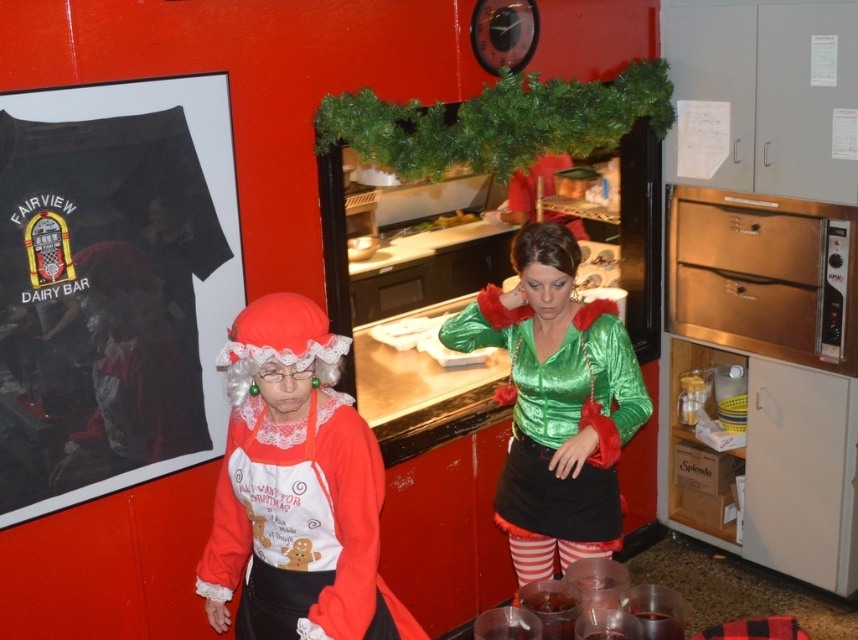
You are standing in the festive kitchen and see the point marked at coordinates (295, 488). What object is located at that point?

The point at coordinates (295, 488) marks the location of the matte white apron at center.

You are a customer at the FAIRVIEW DAIRY BAR and you want to place your translucent glass cup at lower center on the counter. However, there is a green shiny blouse at center in the way. Can you move the cup to the counter without disturbing the blouse?

The green shiny blouse at center is positioned over the translucent glass cup at lower center, so you cannot move the cup without first removing the blouse.